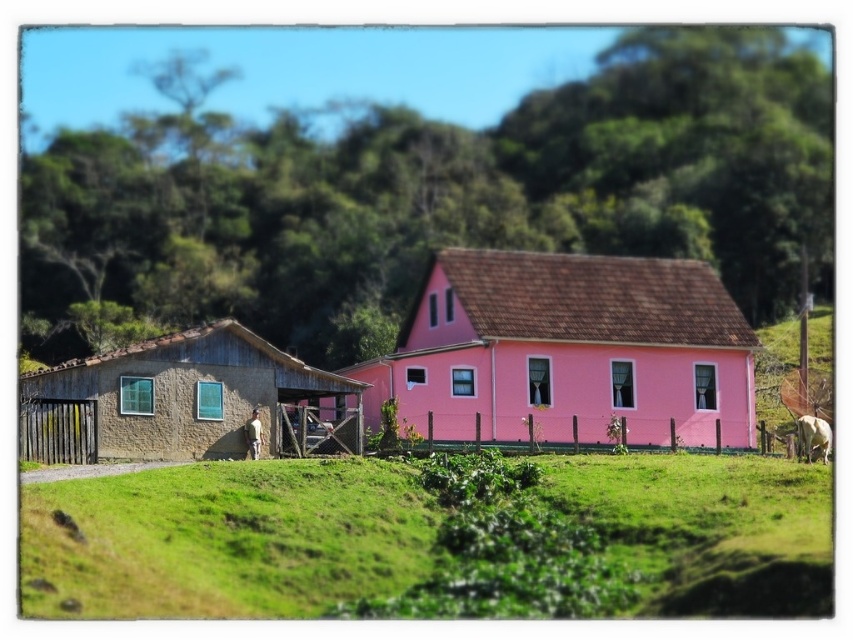
Is green grassy field at lower center thinner than stucco hut at left?

In fact, green grassy field at lower center might be wider than stucco hut at left.

Between point (387, 557) and point (282, 422), which one is positioned behind?

Point (282, 422)

Is point (345, 560) closer to viewer compared to point (155, 429)?

Yes.

At what (x,y) coordinates should I click in order to perform the action: click on green grassy field at lower center. Please return your answer as a coordinate pair (x, y). Looking at the image, I should click on (227, 538).

Is green grassy field at lower center above pink matte house at center?

Actually, green grassy field at lower center is below pink matte house at center.

Does point (680, 547) come farther from viewer compared to point (691, 292)?

No, (680, 547) is in front of (691, 292).

Locate an element on the screen. The height and width of the screenshot is (640, 853). green grassy field at lower center is located at coordinates (227, 538).

Based on the photo, which of these two, pink matte house at center or stucco hut at left, stands taller?

Standing taller between the two is pink matte house at center.

Between pink matte house at center and stucco hut at left, which one is positioned higher?

pink matte house at center is higher up.

This screenshot has height=640, width=853. I want to click on pink matte house at center, so click(x=567, y=349).